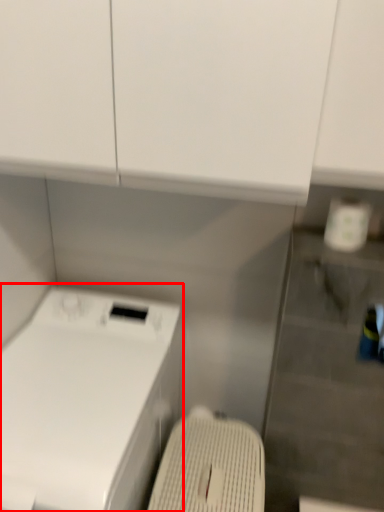
Question: From the image, what is the correct spatial relationship of home appliance (annotated by the red box) in relation to washing machine?

Choices:
 (A) left
 (B) right

Answer: (A)